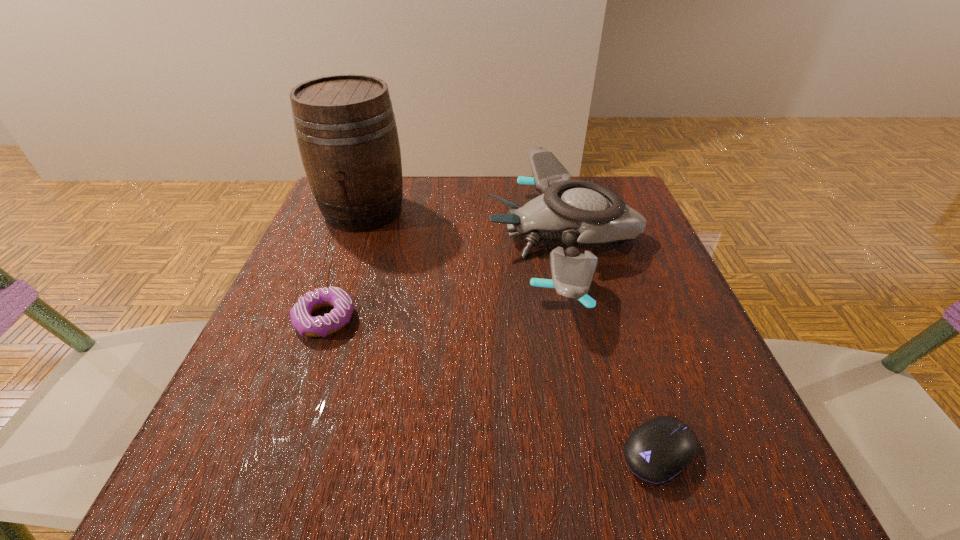
The width and height of the screenshot is (960, 540). What are the coordinates of `cider that is at the far edge` in the screenshot? It's located at (346, 130).

This screenshot has height=540, width=960. In order to click on drone present at the far edge in this screenshot , I will do `click(574, 211)`.

This screenshot has height=540, width=960. What are the coordinates of `object located at the near edge` in the screenshot? It's located at (657, 451).

Find the location of a particular element. This screenshot has height=540, width=960. cider that is at the left edge is located at coordinates (346, 130).

Find the location of a particular element. doughnut positioned at the left edge is located at coordinates (300, 314).

This screenshot has height=540, width=960. What are the coordinates of `drone located at the right edge` in the screenshot? It's located at (574, 211).

Find the location of a particular element. The width and height of the screenshot is (960, 540). computer mouse that is positioned at the right edge is located at coordinates [657, 451].

Identify the location of object at the far left corner. Image resolution: width=960 pixels, height=540 pixels. (346, 130).

You are a GUI agent. You are given a task and a screenshot of the screen. Output one action in this format:
    pyautogui.click(x=<x>, y=<y>)
    Task: Click on the object positioned at the far right corner
    The height and width of the screenshot is (540, 960).
    Given the screenshot: What is the action you would take?
    pyautogui.click(x=574, y=211)

Find the location of a particular element. The image size is (960, 540). object located at the near right corner is located at coordinates (657, 451).